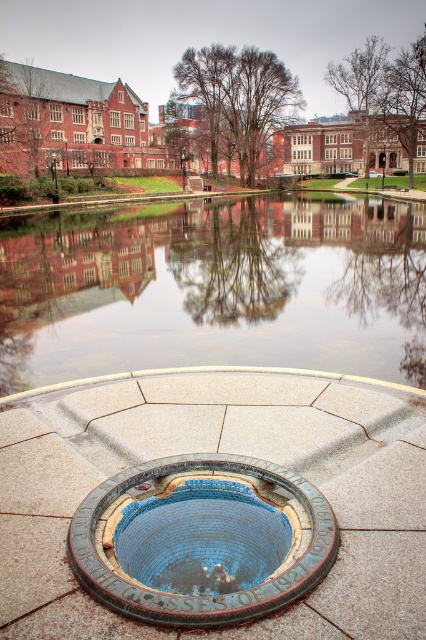
You are standing at the entrance of the campus and want to find the reflective glass lake at center. According to the coordinates provided, which direction should you move from your current position to reach it?

→ The reflective glass lake at center is located at coordinates point (215, 288). Since the coordinates are given in a standard image coordinate system where the origin is at the top left corner, moving towards the center of the image would align with these coordinates. Therefore, you should move straight ahead towards the center of the scene to reach the reflective glass lake at center.

You are a landscape architect designing a new campus layout. You need to place a statue that requires a base 1.2 meters tall. Given the reflective glass lake at center and the blue mosaic pool at center, which one can accommodate the statue based on their heights?

The reflective glass lake at center is taller than the blue mosaic pool at center, so the statue can be placed on the reflective glass lake at center since it meets the required height of 1.2 meters.